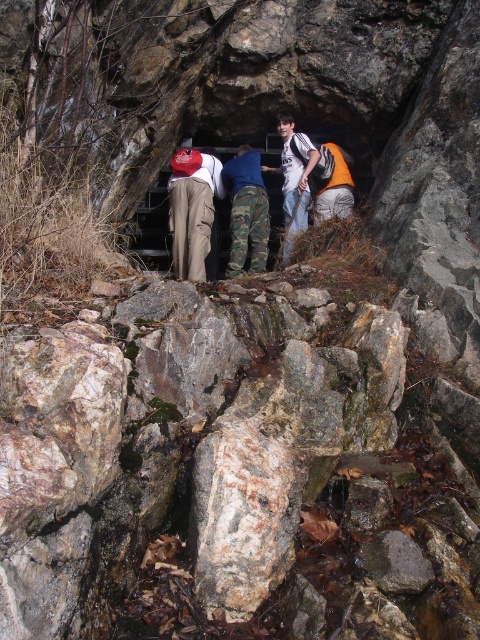
Does camo pants at center have a larger size compared to camouflage pants at center?

Yes, camo pants at center is bigger than camouflage pants at center.

Does camo pants at center lie in front of camouflage pants at center?

Yes, camo pants at center is closer to the viewer.

Does point (232, 252) come in front of point (299, 173)?

That is True.

You are a GUI agent. You are given a task and a screenshot of the screen. Output one action in this format:
    pyautogui.click(x=<x>, y=<y>)
    Task: Click on the camo pants at center
    
    Given the screenshot: What is the action you would take?
    pyautogui.click(x=247, y=211)

Between point (187, 172) and point (261, 256), which one is positioned in front?

Positioned in front is point (261, 256).

Can you confirm if matte khaki pants at center is thinner than camo pants at center?

No, matte khaki pants at center is not thinner than camo pants at center.

Where is `matte khaki pants at center`? This screenshot has height=640, width=480. matte khaki pants at center is located at coordinates (192, 209).

Where is `matte khaki pants at center`? matte khaki pants at center is located at coordinates point(192,209).

Does matte khaki pants at center come in front of camouflage pants at center?

Yes, it is in front of camouflage pants at center.

Does point (190, 243) lie behind point (286, 179)?

No, it is in front of (286, 179).

This screenshot has height=640, width=480. I want to click on matte khaki pants at center, so click(192, 209).